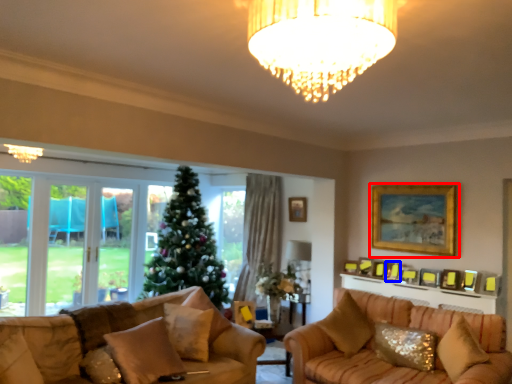
Question: Which object appears farthest to the camera in this image, picture frame (highlighted by a red box) or picture frame (highlighted by a blue box)?

Choices:
 (A) picture frame
 (B) picture frame

Answer: (B)